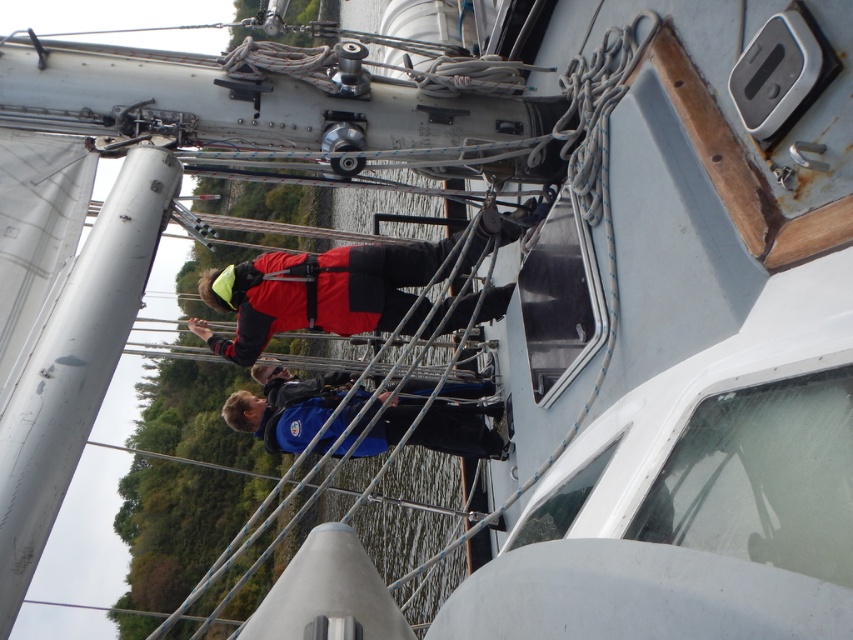
You are a safety inspector checking the equipment on the sailboat. You notice two items at the center of the deck. The red matte life vest at center and the blue fabric jacket at center. Which one is bigger in size?

The red matte life vest at center has a larger size compared to the blue fabric jacket at center.

You are a sailor on the boat and need to reach a point on the deck marked at coordinates point (233, 266). If your current position is 3 meters away from the camera, can you safely walk to that point without getting too close to the edge?

The point (233, 266) is 5.56 meters from the camera. Since you are currently 3 meters away from the camera, you need to move an additional 2.56 meters towards the point to reach it. This distance should be safe as long as you stay within the deck area and avoid the edges.

You are on a sailboat and need to retrieve an item from the deck. There are two items in your line of sight. The red matte life vest at center and the blue fabric jacket at center. Which item is closer to you?

The red matte life vest at center is closer to you because the blue fabric jacket at center is positioned behind it.